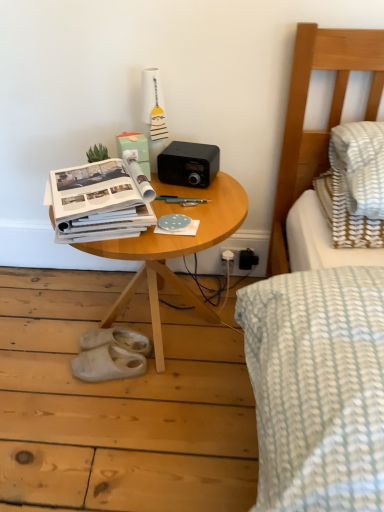
At what (x,y) coordinates should I click in order to perform the action: click on vacant space situated above white rubber slippers at lower left, the 1th footwear in the front-to-back sequence (from a real-world perspective). Please return your answer as a coordinate pair (x, y). Looking at the image, I should click on (115, 351).